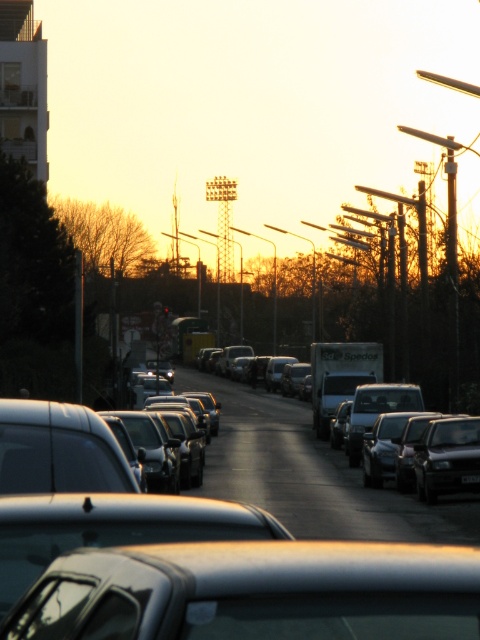
The height and width of the screenshot is (640, 480). What do you see at coordinates (285, 460) in the screenshot? I see `matte black truck at center` at bounding box center [285, 460].

Who is higher up, matte black truck at center or black plastic license plate at center?

black plastic license plate at center

Locate an element on the screen. The image size is (480, 640). matte black truck at center is located at coordinates (285, 460).

The height and width of the screenshot is (640, 480). Describe the element at coordinates (254, 592) in the screenshot. I see `metallic silver car at center` at that location.

Which is in front, point (99, 609) or point (468, 481)?

Point (99, 609) is more forward.

Who is more forward, (456, 586) or (471, 474)?

Point (456, 586) is in front.

At what (x,y) coordinates should I click in order to perform the action: click on metallic silver car at center. Please return your answer as a coordinate pair (x, y). The width and height of the screenshot is (480, 640). Looking at the image, I should click on (254, 592).

Between point (197, 602) and point (325, 520), which one is positioned in front?

Point (197, 602)

Which is in front, point (328, 632) or point (274, 404)?

Positioned in front is point (328, 632).

The image size is (480, 640). What are the coordinates of `metallic silver car at center` in the screenshot? It's located at (x=254, y=592).